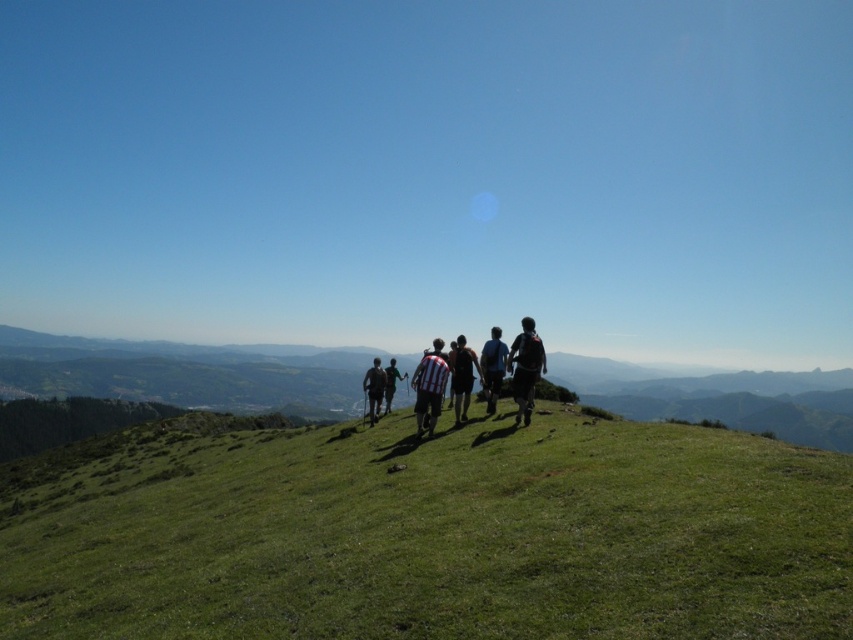
Question: Is the position of striped fabric backpack at center more distant than that of striped fabric shirt at center?

Choices:
 (A) yes
 (B) no

Answer: (B)

Question: Is the position of striped jersey at center less distant than that of black fabric backpack at center?

Choices:
 (A) yes
 (B) no

Answer: (A)

Question: Which is nearer to the striped fabric shirt at center?

Choices:
 (A) striped fabric backpack at center
 (B) black fabric backpack at center
 (C) dark gray backpack at center
 (D) striped jersey at center

Answer: (C)

Question: Is dark gray backpack at center to the right of striped fabric shirt at center from the viewer's perspective?

Choices:
 (A) yes
 (B) no

Answer: (B)

Question: Estimate the real-world distances between objects in this image. Which object is farther from the green grassy hillside at center?

Choices:
 (A) dark blue backpack at center
 (B) striped fabric shirt at center

Answer: (B)

Question: Which object is closer to the camera taking this photo?

Choices:
 (A) black fabric backpack at center
 (B) green grassy hillside at center
 (C) striped fabric shirt at center
 (D) striped jersey at center

Answer: (B)